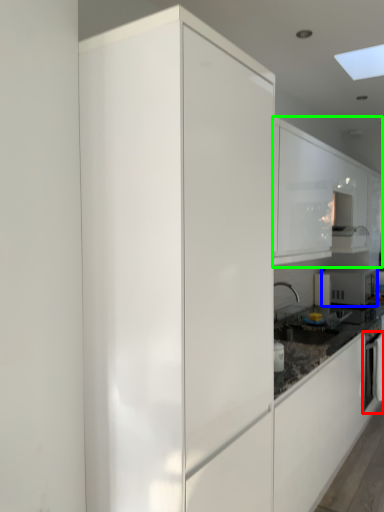
Question: Estimate the real-world distances between objects in this image. Which object is closer to oven (highlighted by a red box), home appliance (highlighted by a blue box) or cabinetry (highlighted by a green box)?

Choices:
 (A) home appliance
 (B) cabinetry

Answer: (A)